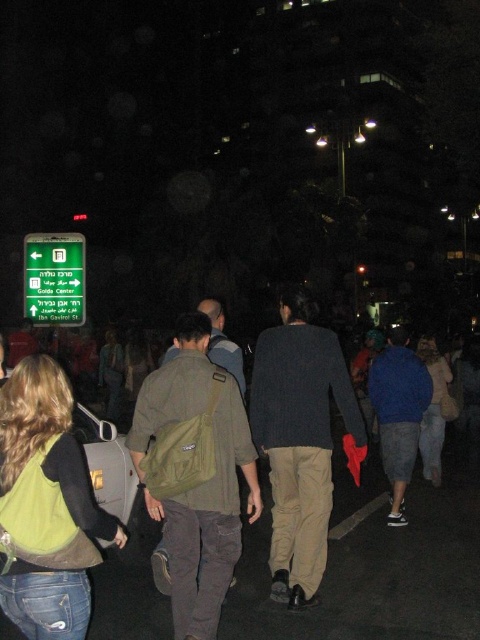
Question: Which point is farther to the camera?

Choices:
 (A) green plastic sign at upper left
 (B) khaki pants at center
 (C) green fabric backpack at center

Answer: (A)

Question: Does green fabric backpack at center have a larger size compared to khaki pants at center?

Choices:
 (A) yes
 (B) no

Answer: (B)

Question: Which is farther from the green fabric backpack at center?

Choices:
 (A) khaki pants at center
 (B) green plastic sign at upper left

Answer: (B)

Question: Which is farther from the green plastic sign at upper left?

Choices:
 (A) khaki pants at center
 (B) green fabric backpack at center

Answer: (B)

Question: Is green fabric backpack at center closer to the viewer compared to khaki pants at center?

Choices:
 (A) no
 (B) yes

Answer: (B)

Question: Is khaki pants at center wider than green plastic sign at upper left?

Choices:
 (A) no
 (B) yes

Answer: (A)